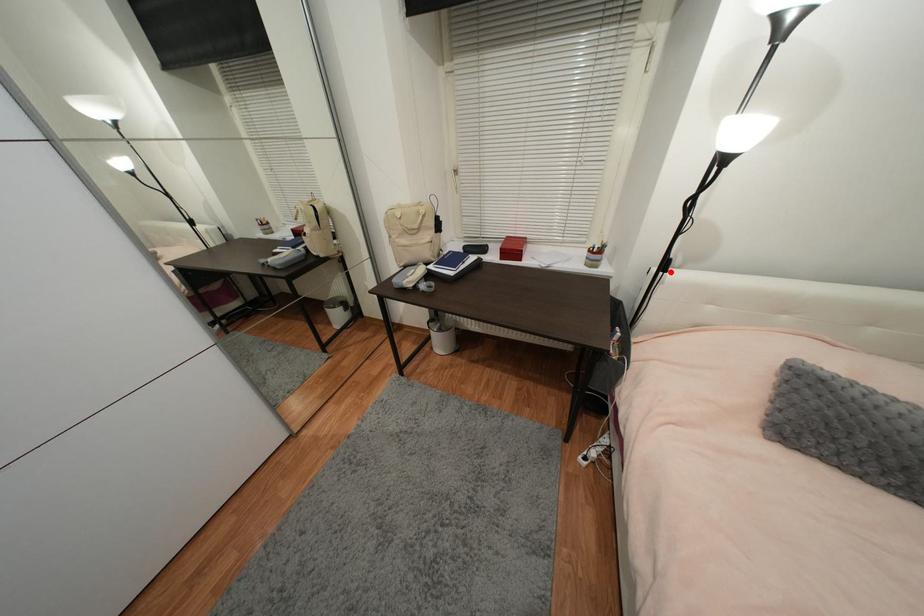
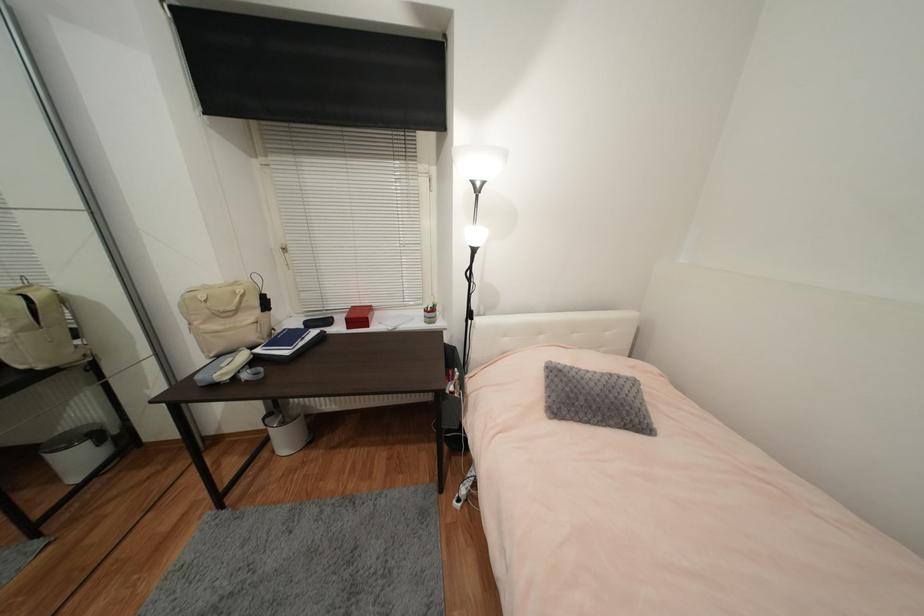
In the second image, find the point that corresponds to the highlighted location in the first image.

(477, 320)